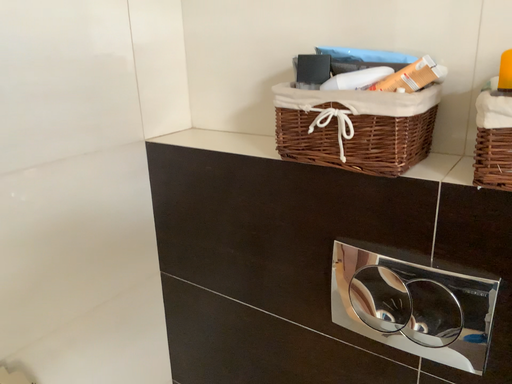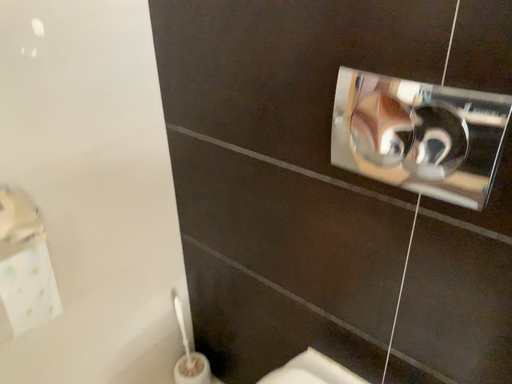
Question: How did the camera likely rotate when shooting the video?

Choices:
 (A) rotated downward
 (B) rotated upward

Answer: (A)